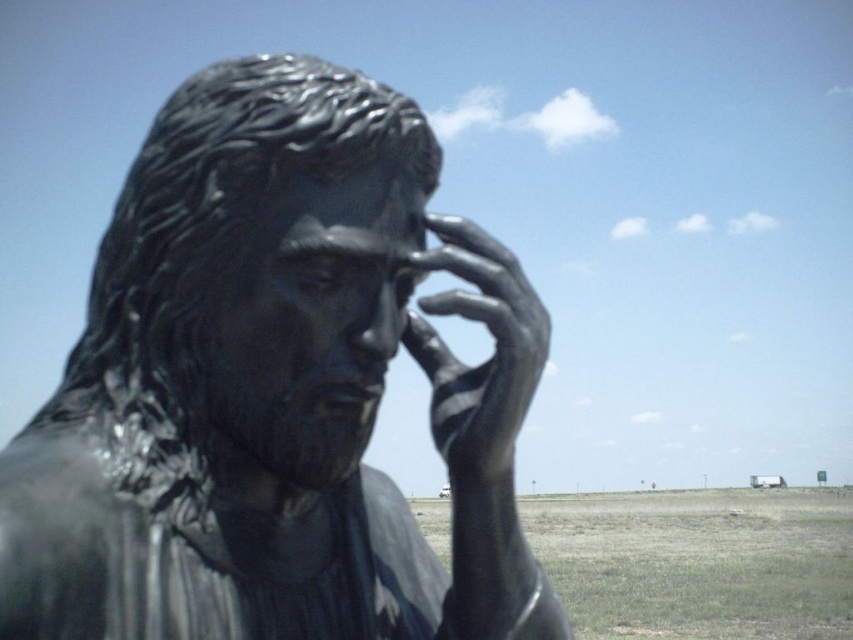
Consider the image. Between shiny bronze statue at center and shiny metallic hand at center, which one has more height?

With more height is shiny bronze statue at center.

Does shiny bronze statue at center lie behind shiny metallic hand at center?

No, shiny bronze statue at center is closer to the viewer.

The width and height of the screenshot is (853, 640). Describe the element at coordinates (274, 388) in the screenshot. I see `shiny bronze statue at center` at that location.

Where is `shiny bronze statue at center`? shiny bronze statue at center is located at coordinates (274, 388).